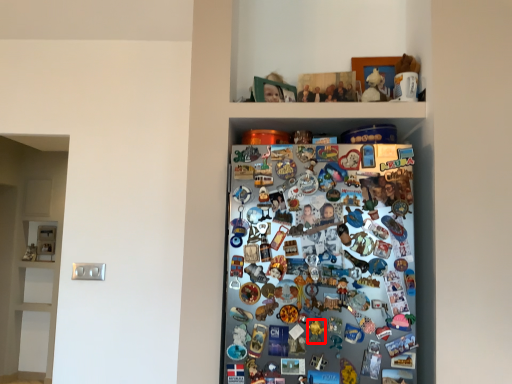
Question: In this image, where is toy (annotated by the red box) located relative to toy?

Choices:
 (A) right
 (B) left

Answer: (B)